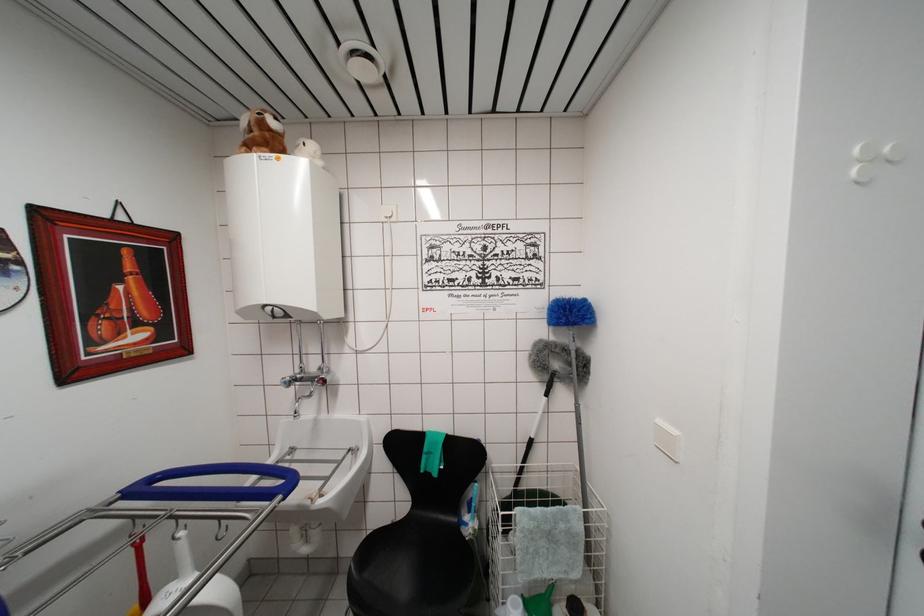
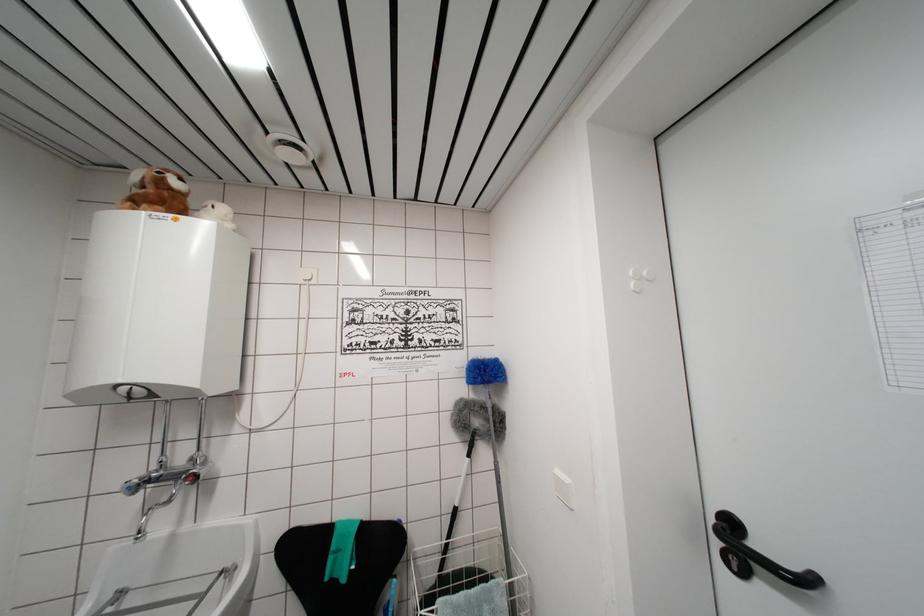
Where in the second image is the point corresponding to [890,155] from the first image?

(649, 278)